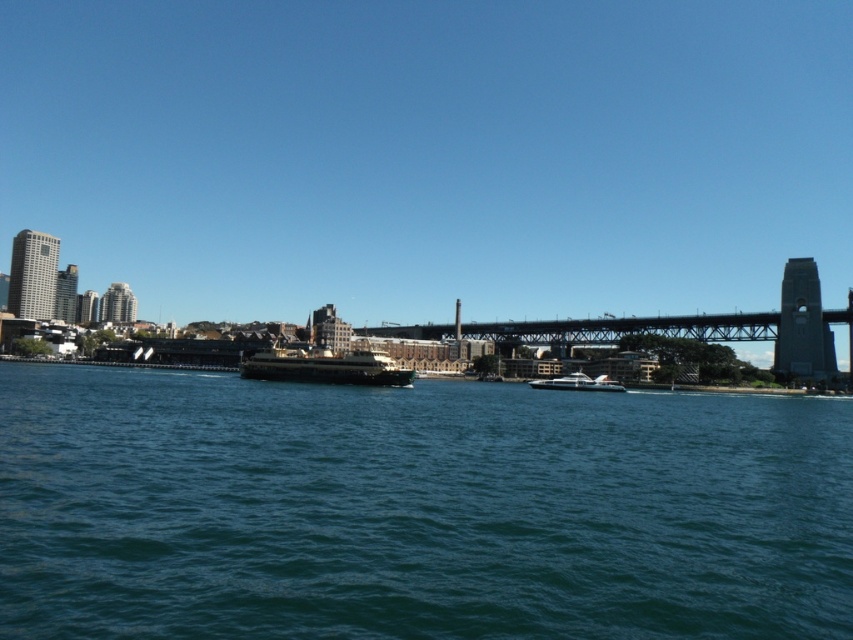
Can you confirm if green water at center is positioned above shiny black ferry at center?

Actually, green water at center is below shiny black ferry at center.

Can you confirm if green water at center is taller than shiny black ferry at center?

Incorrect, green water at center's height is not larger of shiny black ferry at center's.

Image resolution: width=853 pixels, height=640 pixels. Find the location of `green water at center`. green water at center is located at coordinates (415, 509).

Can you confirm if dark gray metallic bridge at center is thinner than metallic silver boat at center?

No, dark gray metallic bridge at center is not thinner than metallic silver boat at center.

Does point (532, 340) come farther from viewer compared to point (579, 385)?

Yes, it is.

Find the location of a particular element. This screenshot has width=853, height=640. dark gray metallic bridge at center is located at coordinates (682, 326).

Can you confirm if green water at center is taller than metallic silver boat at center?

Yes, green water at center is taller than metallic silver boat at center.

The image size is (853, 640). Find the location of `green water at center`. green water at center is located at coordinates (415, 509).